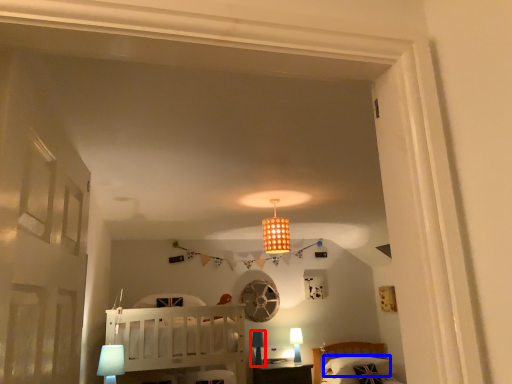
Question: Which object is further to the camera taking this photo, table lamp (highlighted by a red box) or pillow (highlighted by a blue box)?

Choices:
 (A) table lamp
 (B) pillow

Answer: (B)